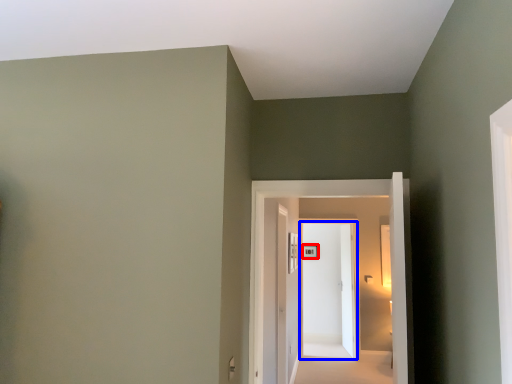
Question: Which of the following is the farthest to the observer, picture frame (highlighted by a red box) or door (highlighted by a blue box)?

Choices:
 (A) picture frame
 (B) door

Answer: (A)